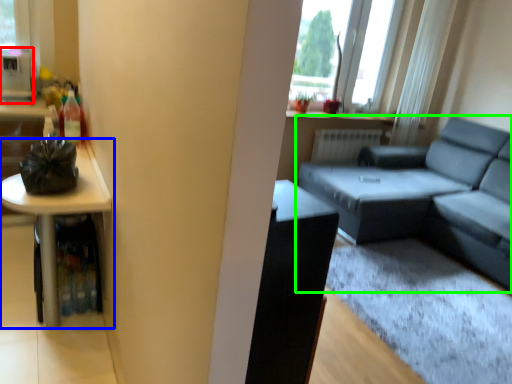
Question: Considering the real-world distances, which object is farthest from appliance (highlighted by a red box)? table (highlighted by a blue box) or studio couch (highlighted by a green box)?

Choices:
 (A) table
 (B) studio couch

Answer: (B)